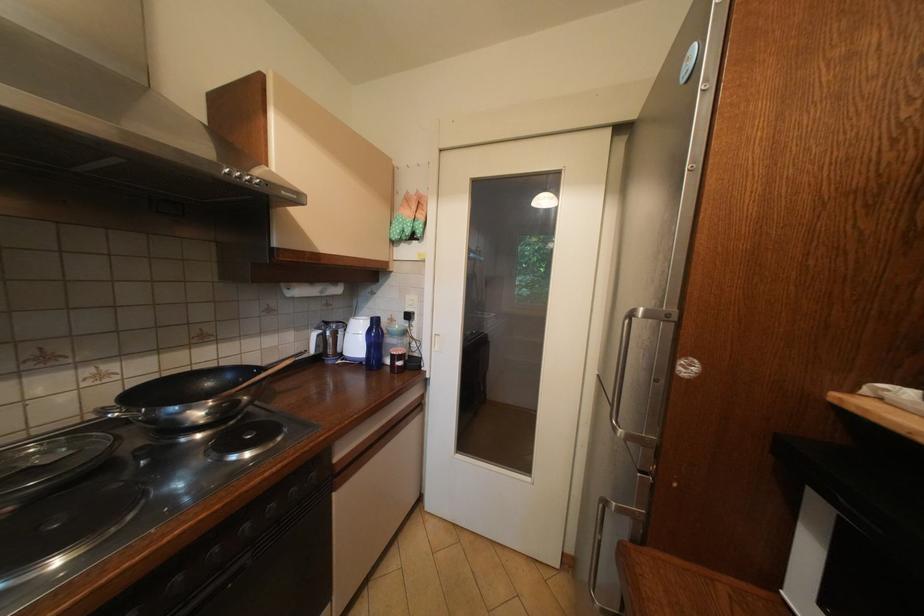
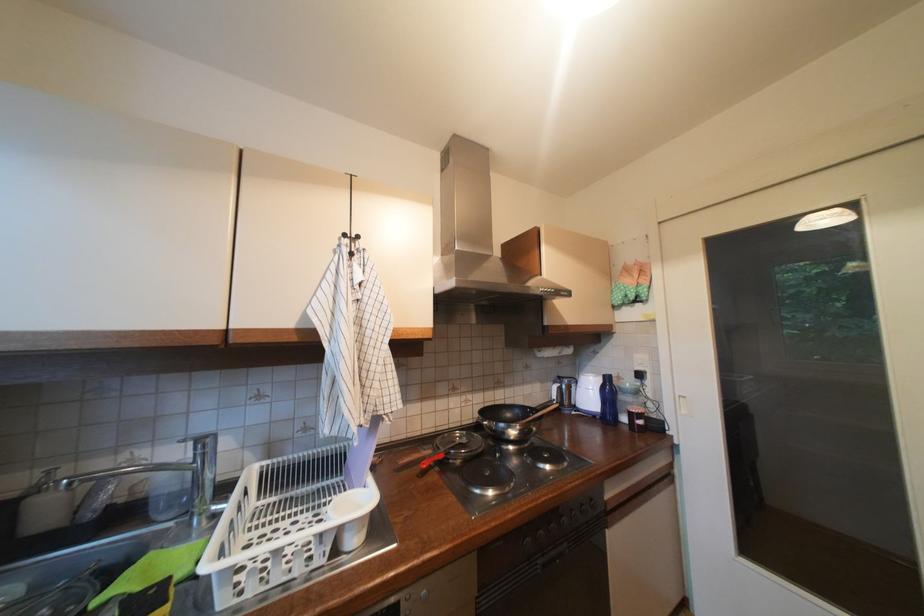
Question: The camera is either moving clockwise (left) or counter-clockwise (right) around the object. The first image is from the beginning of the video and the second image is from the end. Is the camera moving left or right when shooting the video?

Choices:
 (A) Left
 (B) Right

Answer: (B)